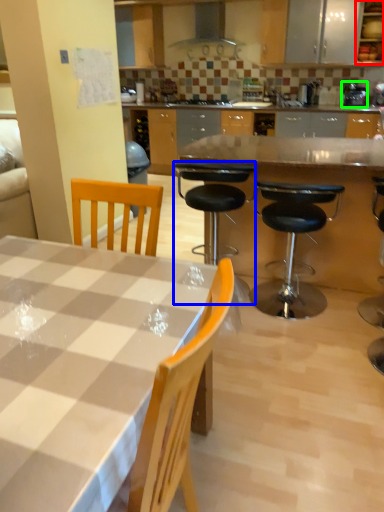
Question: Based on their relative distances, which object is farther from cabinetry (highlighted by a red box)? Choose from chair (highlighted by a blue box) and appliance (highlighted by a green box).

Choices:
 (A) chair
 (B) appliance

Answer: (A)